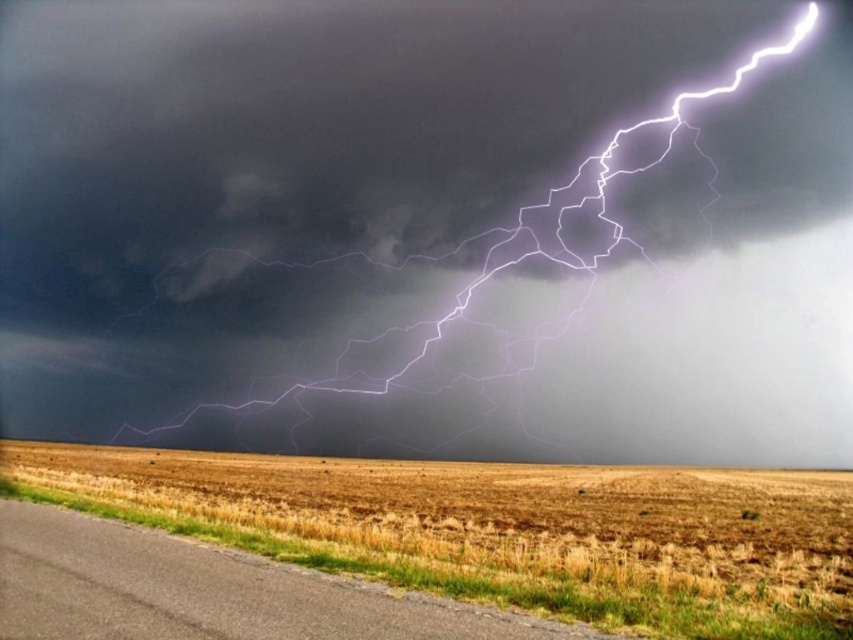
Between white lightning at upper right and dry grass at lower left, which one has less height?

Standing shorter between the two is dry grass at lower left.

Does point (207, 273) lie behind point (374, 465)?

Yes, it is behind point (374, 465).

Where is `white lightning at upper right`? white lightning at upper right is located at coordinates (428, 227).

Locate an element on the screen. white lightning at upper right is located at coordinates (428, 227).